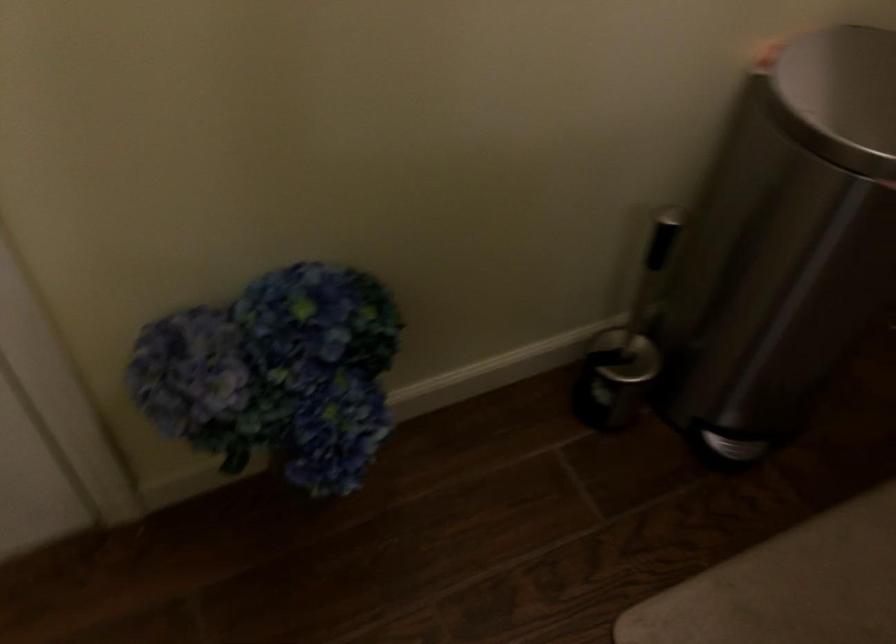
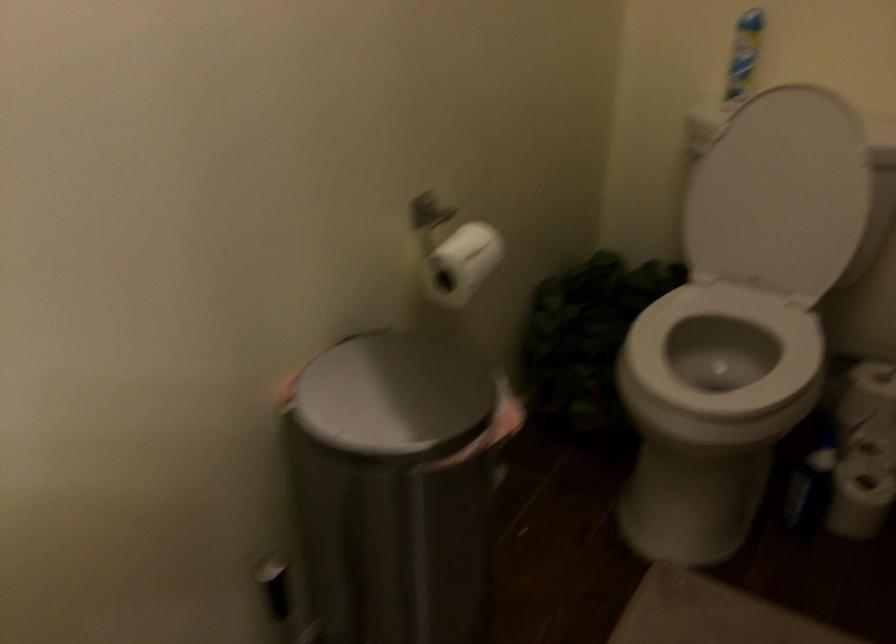
Question: The camera is either moving clockwise (left) or counter-clockwise (right) around the object. The first image is from the beginning of the video and the second image is from the end. Is the camera moving left or right when shooting the video?

Choices:
 (A) Left
 (B) Right

Answer: (A)